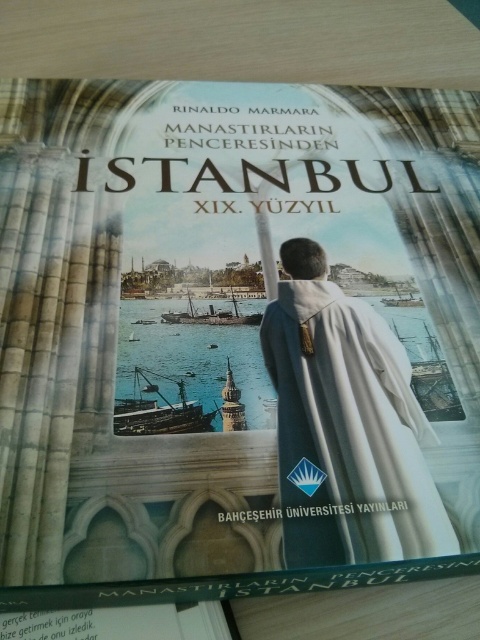
Question: Does white matte robe at center appear on the right side of metallic sheen steamboat at center?

Choices:
 (A) yes
 (B) no

Answer: (A)

Question: Which point is farther to the camera?

Choices:
 (A) (188, 300)
 (B) (156, 387)
 (C) (349, 346)

Answer: (A)

Question: Does white matte robe at center appear over wooden ship at center?

Choices:
 (A) no
 (B) yes

Answer: (B)

Question: Based on their relative distances, which object is farther from the wooden ship at center?

Choices:
 (A) white matte robe at center
 (B) metallic sheen steamboat at center

Answer: (A)

Question: Which point is farther to the camera?

Choices:
 (A) (172, 420)
 (B) (204, 316)

Answer: (B)

Question: Is white matte robe at center below metallic sheen steamboat at center?

Choices:
 (A) no
 (B) yes

Answer: (B)